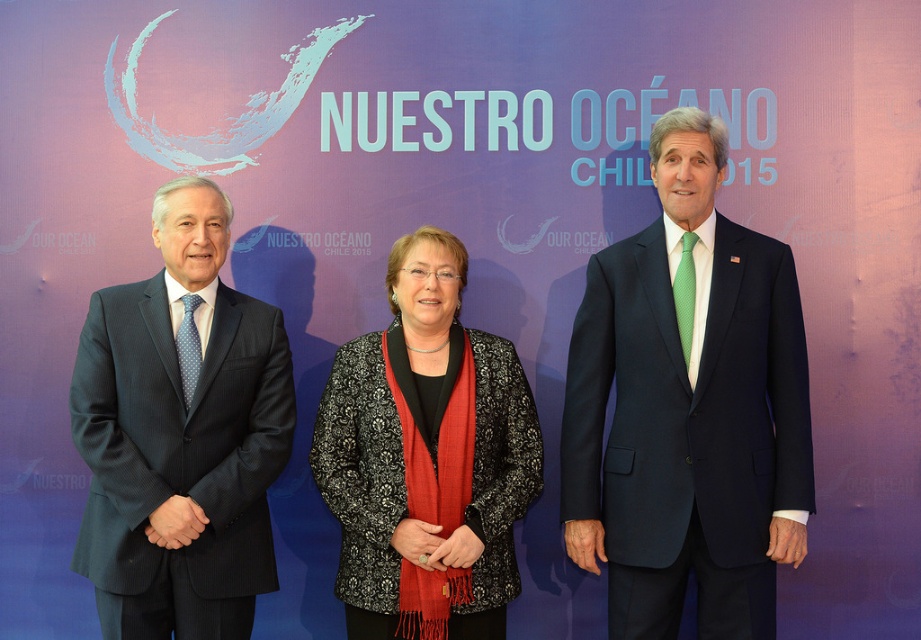
Question: Estimate the real-world distances between objects in this image. Which object is closer to the dark blue pinstripe suit at left?

Choices:
 (A) black textured jacket at center
 (B) navy blue suit at center

Answer: (A)

Question: Does navy blue suit at center appear under dark blue pinstripe suit at left?

Choices:
 (A) yes
 (B) no

Answer: (B)

Question: Among these points, which one is farthest from the camera?

Choices:
 (A) (86, 419)
 (B) (749, 570)
 (C) (504, 396)

Answer: (C)

Question: Can you confirm if navy blue suit at center is thinner than black textured jacket at center?

Choices:
 (A) yes
 (B) no

Answer: (B)

Question: Which point is closer to the camera taking this photo?

Choices:
 (A) (181, 180)
 (B) (342, 556)
 (C) (755, 508)

Answer: (C)

Question: Can you confirm if navy blue suit at center is positioned to the left of dark blue pinstripe suit at left?

Choices:
 (A) no
 (B) yes

Answer: (A)